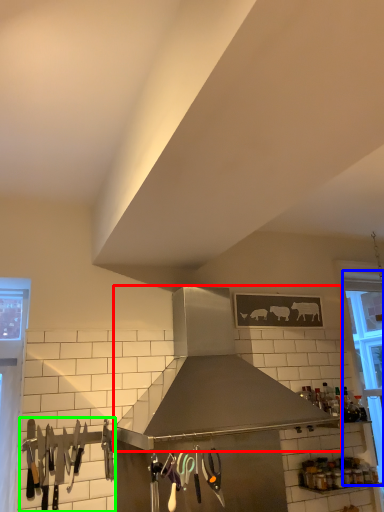
Question: Which object is the closest to the kitchen appliance (highlighted by a red box)? Choose among these: window (highlighted by a blue box) or silverware (highlighted by a green box).

Choices:
 (A) window
 (B) silverware

Answer: (B)